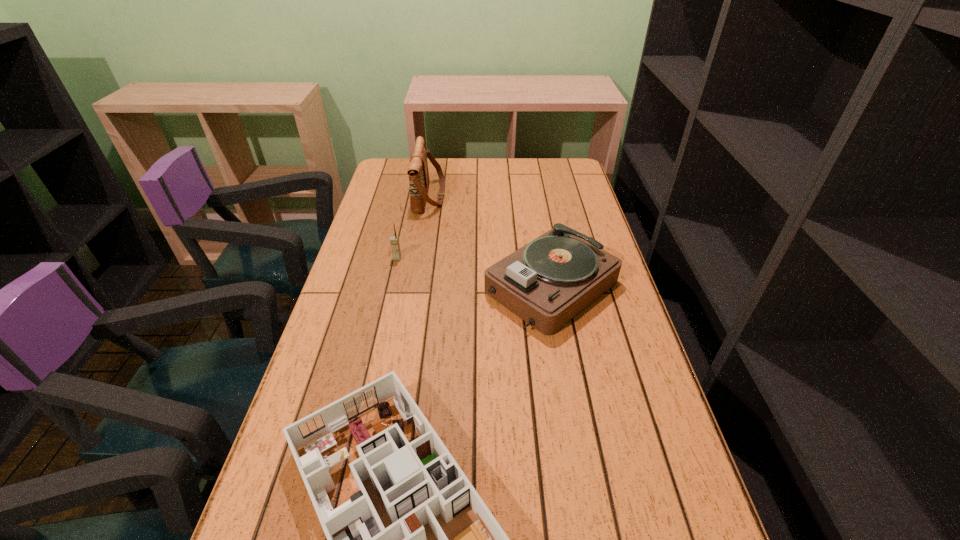
This screenshot has height=540, width=960. What are the coordinates of `object located in the right edge section of the desktop` in the screenshot? It's located at (547, 282).

This screenshot has height=540, width=960. Identify the location of object that is at the far left corner. (418, 172).

Where is `vacant space at the left edge of the desktop`? vacant space at the left edge of the desktop is located at coordinates (325, 390).

In the image, there is a desktop. At what (x,y) coordinates should I click in order to perform the action: click on vacant region at the right edge. Please return your answer as a coordinate pair (x, y). The height and width of the screenshot is (540, 960). Looking at the image, I should click on [554, 213].

In the image, there is a desktop. At what (x,y) coordinates should I click in order to perform the action: click on blank space at the far right corner. Please return your answer as a coordinate pair (x, y). This screenshot has width=960, height=540. Looking at the image, I should click on (564, 179).

Locate an element on the screen. The image size is (960, 540). empty location between the record player and the cellular telephone is located at coordinates (474, 273).

Image resolution: width=960 pixels, height=540 pixels. I want to click on vacant space that is in between the record player and the cellular telephone, so click(474, 273).

This screenshot has width=960, height=540. Find the location of `vacant area between the cellular telephone and the farthest object`. vacant area between the cellular telephone and the farthest object is located at coordinates (414, 227).

Image resolution: width=960 pixels, height=540 pixels. Identify the location of vacant space that's between the cellular telephone and the record player. (474, 273).

Locate an element on the screen. This screenshot has height=540, width=960. vacant space that's between the record player and the shoulder bag is located at coordinates (491, 242).